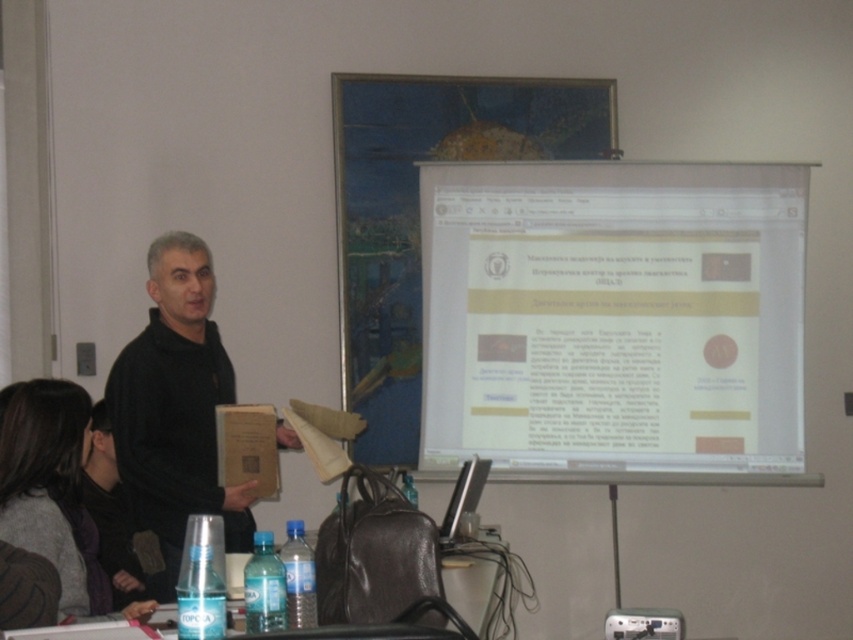
You are organizing a classroom event and need to decide which item to move first. Based on their sizes, which item should you move first, the gray sweater at lower left or the translucent plastic table at lower center?

The gray sweater at lower left is bigger than the translucent plastic table at lower center, so you should move the gray sweater at lower left first to accommodate its larger size.

You are a student sitting at the back of the classroom. You notice the black matte sweater at center and the translucent plastic table at lower center. Which object is closer to you?

The black matte sweater at center is closer to you because it is positioned over the translucent plastic table at lower center, indicating it is in front of it.